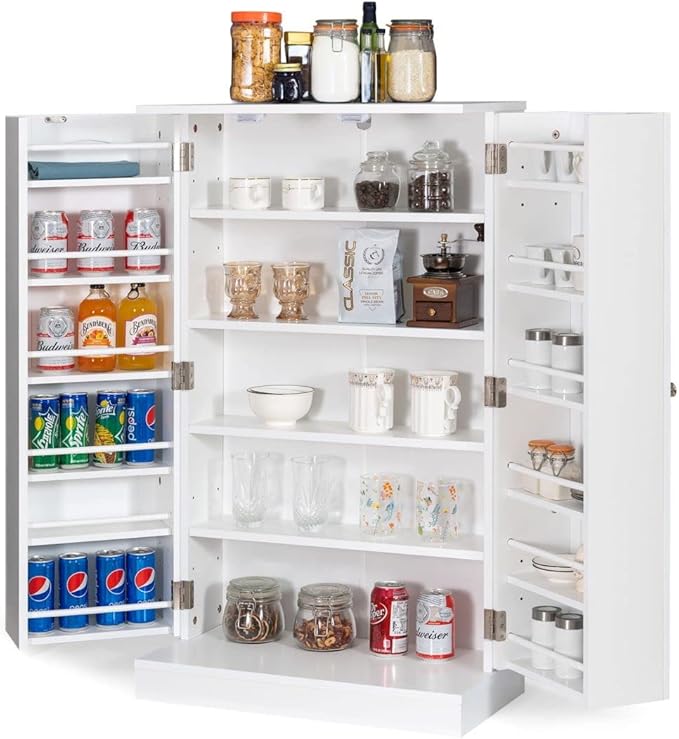
Where is `mugs`? The width and height of the screenshot is (679, 739). mugs is located at coordinates (251, 191), (285, 194), (538, 168), (564, 168), (580, 171), (532, 275), (562, 275), (381, 392), (411, 398).